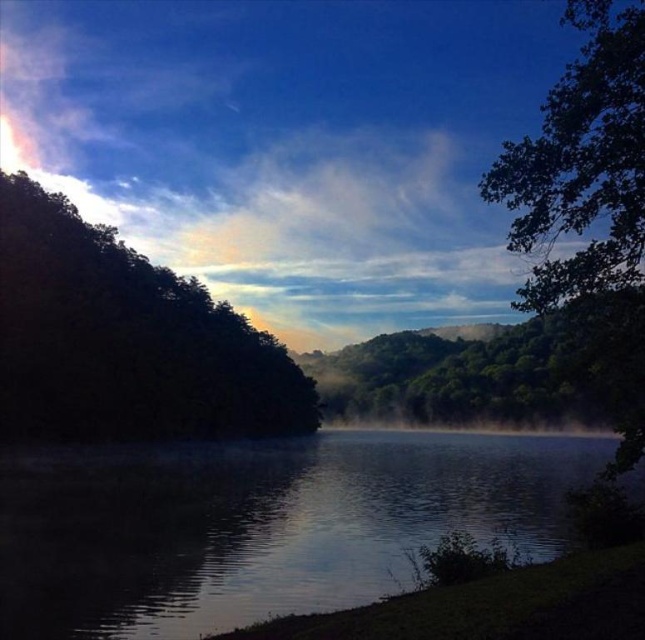
Does green leafy tree at upper right lie behind green leafy tree at center?

That is False.

Which is more to the left, green leafy tree at upper right or green leafy tree at center?

From the viewer's perspective, green leafy tree at center appears more on the left side.

This screenshot has height=640, width=645. I want to click on green leafy tree at upper right, so click(580, 163).

Looking at this image, is dark green leafy tree at left shorter than green leafy tree at upper right?

Yes, dark green leafy tree at left is shorter than green leafy tree at upper right.

Does dark green leafy tree at left appear over green leafy tree at upper right?

Actually, dark green leafy tree at left is below green leafy tree at upper right.

Does point (139, 356) come in front of point (597, 10)?

No, (139, 356) is further to viewer.

Where is `dark green leafy tree at left`? dark green leafy tree at left is located at coordinates (124, 340).

Measure the distance between mist at center and camera.

A distance of 68.64 feet exists between mist at center and camera.

Does mist at center appear on the left side of dark reflective water at center?

Correct, you'll find mist at center to the left of dark reflective water at center.

Does point (457, 61) come closer to viewer compared to point (328, 538)?

No, (457, 61) is further to viewer.

Where is `mist at center`? The height and width of the screenshot is (640, 645). mist at center is located at coordinates (290, 145).